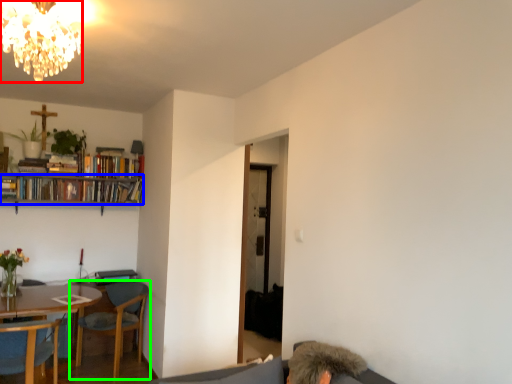
Question: Which object is positioned closest to lamp (highlighted by a red box)? Select from book (highlighted by a blue box) and chair (highlighted by a green box).

Choices:
 (A) book
 (B) chair

Answer: (B)